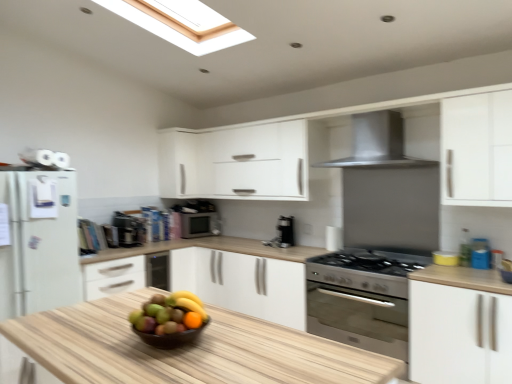
Question: Considering the relative positions of shiny brown bowl at center and satin black coffee maker at center, positioned as the 1th appliance in front-to-back order, in the image provided, is shiny brown bowl at center to the left of satin black coffee maker at center, positioned as the 1th appliance in front-to-back order, from the viewer's perspective?

Choices:
 (A) yes
 (B) no

Answer: (B)

Question: Is the surface of shiny brown bowl at center in direct contact with satin black coffee maker at center, which appears as the first appliance when viewed from the left?

Choices:
 (A) no
 (B) yes

Answer: (A)

Question: Can you confirm if shiny brown bowl at center is wider than satin black coffee maker at center, positioned as the 2th appliance in back-to-front order?

Choices:
 (A) yes
 (B) no

Answer: (B)

Question: Is shiny brown bowl at center looking in the opposite direction of satin black coffee maker at center, positioned as the 1th appliance in front-to-back order?

Choices:
 (A) no
 (B) yes

Answer: (A)

Question: Considering the relative sizes of shiny brown bowl at center and satin black coffee maker at center, positioned as the 1th appliance in front-to-back order, in the image provided, is shiny brown bowl at center thinner than satin black coffee maker at center, positioned as the 1th appliance in front-to-back order,?

Choices:
 (A) no
 (B) yes

Answer: (B)

Question: Is metallic silver microwave at center, arranged as the 2th appliance when viewed from the front, taller or shorter than white matte cabinet at upper center, the 2th cabinetry positioned from the bottom?

Choices:
 (A) short
 (B) tall

Answer: (A)

Question: From a real-world perspective, relative to white matte cabinet at upper center, the first cabinetry when ordered from left to right, is metallic silver microwave at center, arranged as the 2th appliance when viewed from the left, vertically above or below?

Choices:
 (A) below
 (B) above

Answer: (A)

Question: From the image's perspective, is metallic silver microwave at center, the 1th appliance from the back, located above or below white matte cabinet at upper center, the first cabinetry positioned from the back?

Choices:
 (A) above
 (B) below

Answer: (B)

Question: Is metallic silver microwave at center, the 1th appliance from the back, spatially inside white matte cabinet at upper center, the 2th cabinetry positioned from the bottom, or outside of it?

Choices:
 (A) inside
 (B) outside

Answer: (B)

Question: From the image's perspective, relative to shiny brown bowl at center, is white matte cabinet at right, which is the 1th cabinetry in bottom-to-top order, above or below?

Choices:
 (A) below
 (B) above

Answer: (A)

Question: Looking at their shapes, would you say white matte cabinet at right, which is the 1th cabinetry in bottom-to-top order, is wider or thinner than shiny brown bowl at center?

Choices:
 (A) thin
 (B) wide

Answer: (B)

Question: In terms of height, does white matte cabinet at right, which is the 2th cabinetry from top to bottom, look taller or shorter compared to shiny brown bowl at center?

Choices:
 (A) tall
 (B) short

Answer: (A)

Question: Considering their positions, is white matte cabinet at right, which is counted as the 2th cabinetry, starting from the left, located in front of or behind shiny brown bowl at center?

Choices:
 (A) behind
 (B) front

Answer: (A)

Question: In terms of height, does metallic silver microwave at center, arranged as the 1th appliance when viewed from the right, look taller or shorter compared to white matte cabinet at right, which is the first cabinetry from front to back?

Choices:
 (A) tall
 (B) short

Answer: (B)

Question: From the image's perspective, is metallic silver microwave at center, arranged as the 2th appliance when viewed from the left, located above or below white matte cabinet at right, which ranks as the second cabinetry in back-to-front order?

Choices:
 (A) above
 (B) below

Answer: (A)